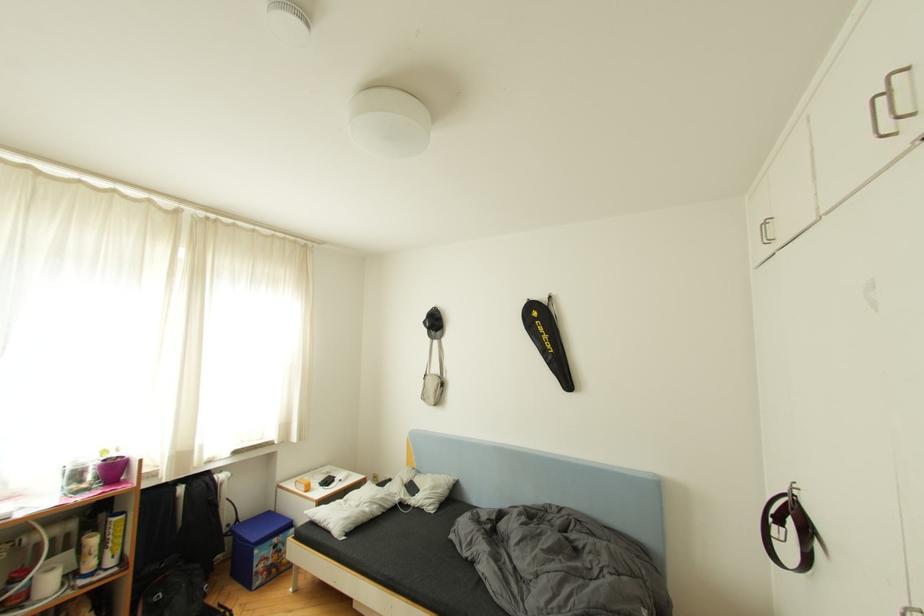
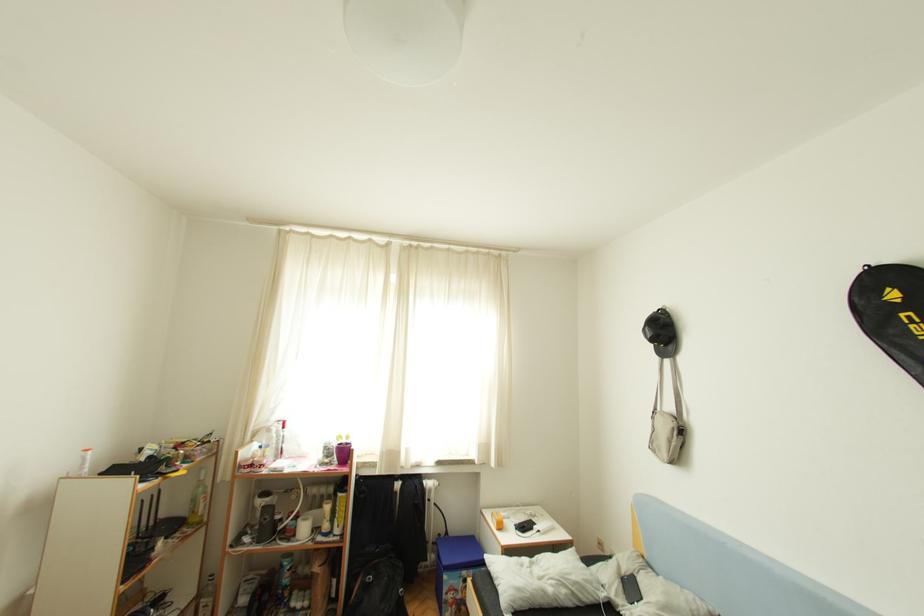
Question: The camera is either moving clockwise (left) or counter-clockwise (right) around the object. The first image is from the beginning of the video and the second image is from the end. Is the camera moving left or right when shooting the video?

Choices:
 (A) Left
 (B) Right

Answer: (B)